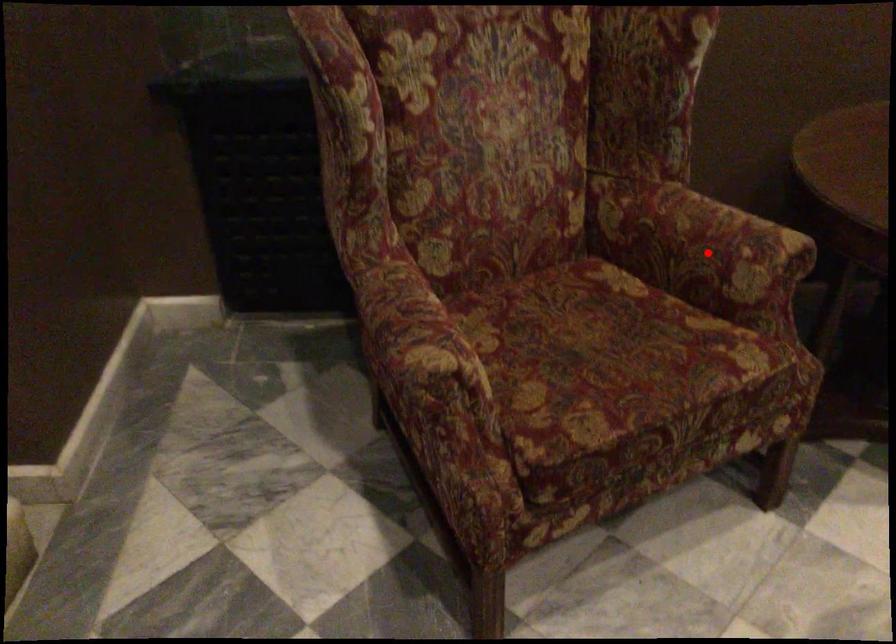
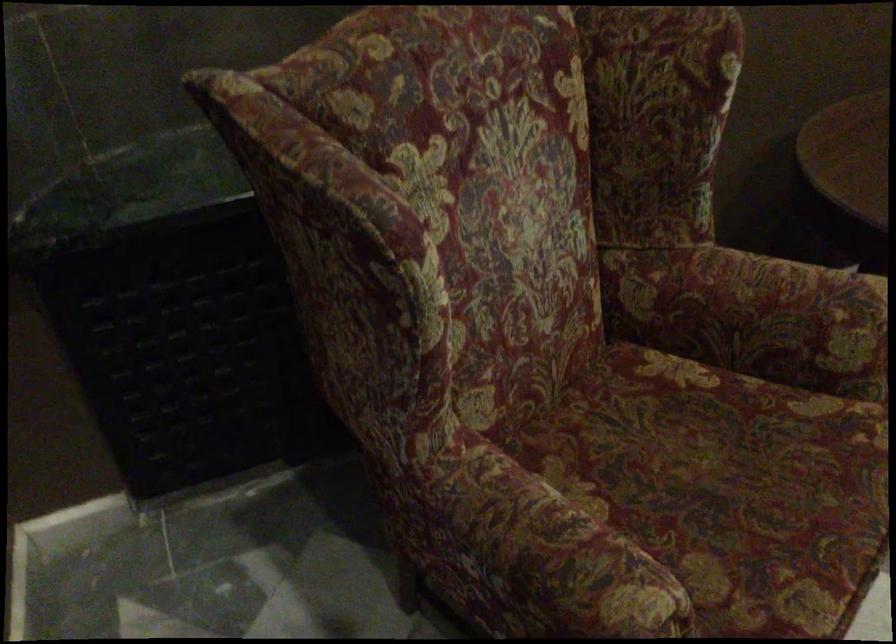
Find the pixel in the second image that matches the highlighted location in the first image.

(786, 321)